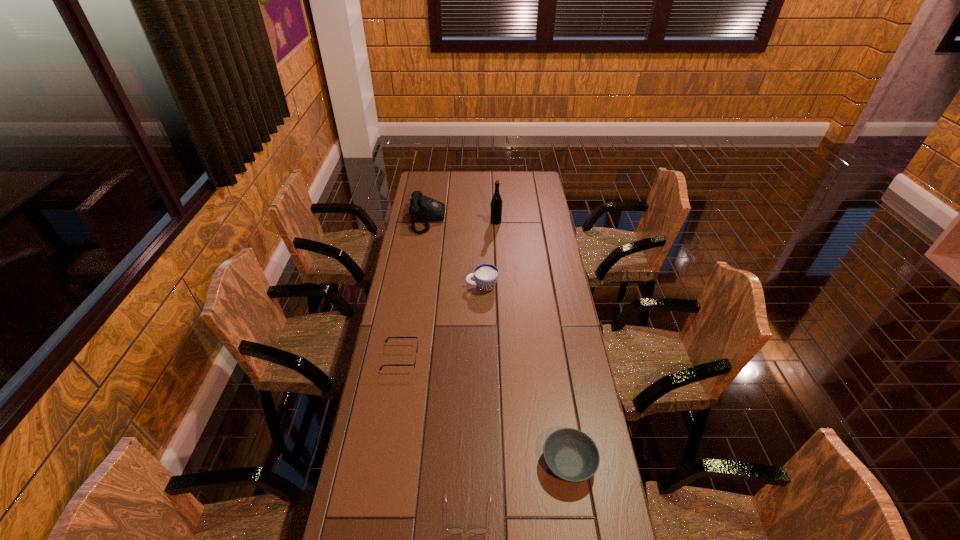
Find the location of a particular element. empty location between the left spectacles and the nearer spectacles is located at coordinates (435, 436).

Identify the location of free spot between the fourth nearest object and the tallest object. (489, 254).

Where is `empty space between the third shortest object and the third farthest object`? The width and height of the screenshot is (960, 540). empty space between the third shortest object and the third farthest object is located at coordinates (525, 375).

In order to click on unoccupied area between the right spectacles and the cup in this screenshot , I will do `click(475, 400)`.

I want to click on the fourth closest object to the tallest object, so click(571, 455).

What are the coordinates of `the second closest object to the beer bottle` in the screenshot? It's located at (485, 275).

Identify the location of free spot that satisfies the following two spatial constraints: 1. on the dial of the fifth shortest object; 2. on the right side of the fifth farthest object. (390, 463).

Identify the location of free region that satisfies the following two spatial constraints: 1. on the side of the third tallest object with the handle; 2. on the temples of the nearest object. The image size is (960, 540). (483, 515).

Find the location of `vacant space that satisfies the following two spatial constraints: 1. on the dial of the tallest object; 2. on the right side of the second tallest object`. vacant space that satisfies the following two spatial constraints: 1. on the dial of the tallest object; 2. on the right side of the second tallest object is located at coordinates (427, 222).

I want to click on blank space that satisfies the following two spatial constraints: 1. on the dial of the telephone; 2. on the left side of the third shortest object, so click(x=390, y=463).